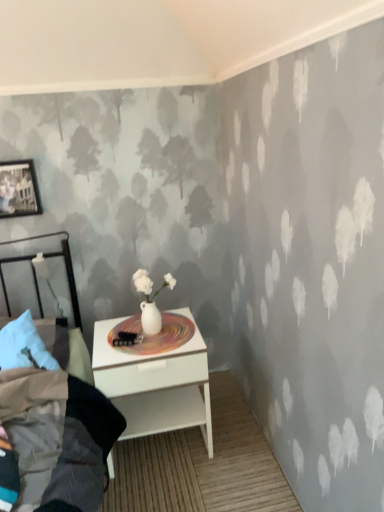
Question: From a real-world perspective, is white glossy vase at center located higher than matte black picture frame at upper left?

Choices:
 (A) no
 (B) yes

Answer: (A)

Question: Does white glossy vase at center appear on the left side of matte black picture frame at upper left?

Choices:
 (A) yes
 (B) no

Answer: (B)

Question: Can you confirm if white glossy vase at center is bigger than matte black picture frame at upper left?

Choices:
 (A) no
 (B) yes

Answer: (A)

Question: Is white glossy vase at center smaller than matte black picture frame at upper left?

Choices:
 (A) no
 (B) yes

Answer: (B)

Question: Does white glossy vase at center turn towards matte black picture frame at upper left?

Choices:
 (A) no
 (B) yes

Answer: (A)

Question: Is matte black picture frame at upper left bigger or smaller than white glossy nightstand at lower center?

Choices:
 (A) big
 (B) small

Answer: (B)

Question: Is point (29, 198) closer or farther from the camera than point (172, 428)?

Choices:
 (A) farther
 (B) closer

Answer: (A)

Question: From the image's perspective, is matte black picture frame at upper left positioned above or below white glossy nightstand at lower center?

Choices:
 (A) above
 (B) below

Answer: (A)

Question: Considering the positions of matte black picture frame at upper left and white glossy nightstand at lower center in the image, is matte black picture frame at upper left wider or thinner than white glossy nightstand at lower center?

Choices:
 (A) thin
 (B) wide

Answer: (A)

Question: From their relative heights in the image, would you say white glossy vase at center is taller or shorter than matte black picture frame at upper left?

Choices:
 (A) short
 (B) tall

Answer: (A)

Question: Considering the positions of white glossy vase at center and matte black picture frame at upper left in the image, is white glossy vase at center bigger or smaller than matte black picture frame at upper left?

Choices:
 (A) small
 (B) big

Answer: (A)

Question: From the image's perspective, relative to matte black picture frame at upper left, is white glossy vase at center above or below?

Choices:
 (A) above
 (B) below

Answer: (B)

Question: Is white glossy vase at center inside or outside of matte black picture frame at upper left?

Choices:
 (A) outside
 (B) inside

Answer: (A)

Question: Looking at their shapes, would you say white glossy nightstand at lower center is wider or thinner than white glossy vase at center?

Choices:
 (A) thin
 (B) wide

Answer: (B)

Question: From the image's perspective, is white glossy nightstand at lower center positioned above or below white glossy vase at center?

Choices:
 (A) above
 (B) below

Answer: (B)